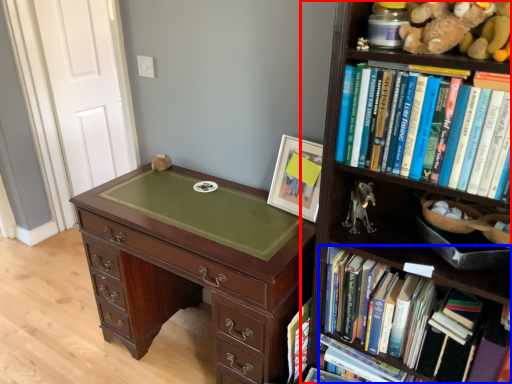
Question: Which of the following is the farthest to the observer, bookcase (highlighted by a red box) or book (highlighted by a blue box)?

Choices:
 (A) bookcase
 (B) book

Answer: (B)